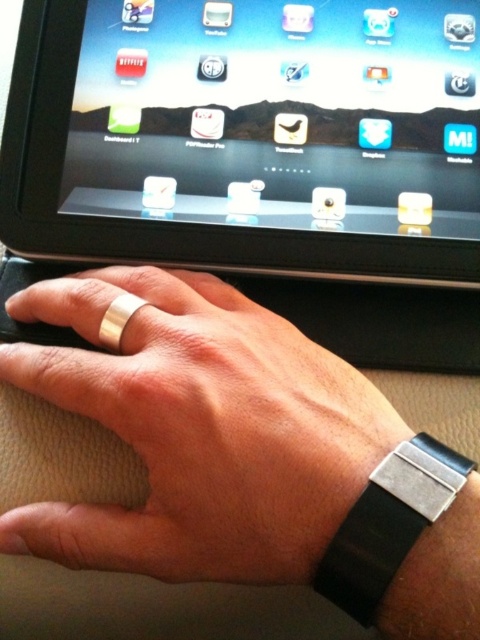
Can you confirm if black glossy tablet at upper center is taller than silver metallic ring at center?

Correct, black glossy tablet at upper center is much taller as silver metallic ring at center.

Describe the element at coordinates (245, 134) in the screenshot. I see `black glossy tablet at upper center` at that location.

At what (x,y) coordinates should I click in order to perform the action: click on black glossy tablet at upper center. Please return your answer as a coordinate pair (x, y). This screenshot has width=480, height=640. Looking at the image, I should click on (245, 134).